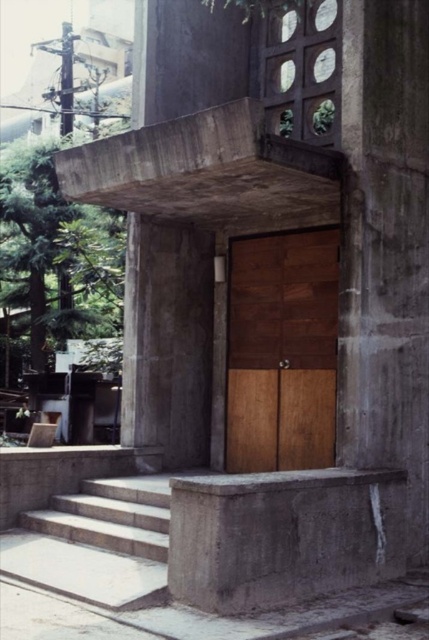
Does point (250, 460) lie behind point (27, 269)?

No, it is not.

Can you confirm if wooden door at center is taller than green leafy tree at left?

No.

Which is in front, point (329, 280) or point (102, 314)?

Positioned in front is point (329, 280).

The image size is (429, 640). I want to click on wooden door at center, so click(x=281, y=352).

You are a GUI agent. You are given a task and a screenshot of the screen. Output one action in this format:
    pyautogui.click(x=<x>, y=<y>)
    Task: Click on the wooden door at center
    This screenshot has height=640, width=429.
    Given the screenshot: What is the action you would take?
    pyautogui.click(x=281, y=352)

Can you confirm if wooden door at center is positioned to the left of white concrete stairs at lower left?

Incorrect, wooden door at center is not on the left side of white concrete stairs at lower left.

Does point (238, 362) come farther from viewer compared to point (66, 525)?

Yes, point (238, 362) is behind point (66, 525).

At what (x,y) coordinates should I click in order to perform the action: click on wooden door at center. Please return your answer as a coordinate pair (x, y). Looking at the image, I should click on (281, 352).

Is green leafy tree at left to the right of white concrete stairs at lower left from the viewer's perspective?

Incorrect, green leafy tree at left is not on the right side of white concrete stairs at lower left.

Between green leafy tree at left and white concrete stairs at lower left, which one has more height?

green leafy tree at left is taller.

Which is in front, point (76, 310) or point (144, 536)?

Point (144, 536) is in front.

The image size is (429, 640). Identify the location of green leafy tree at left. (57, 252).